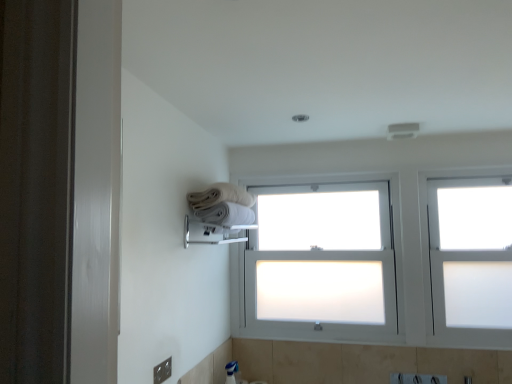
Question: From a real-world perspective, is white soft towel at upper center, which is counted as the 2th towel, starting from the top, positioned under white frosted glass window at upper right based on gravity?

Choices:
 (A) yes
 (B) no

Answer: (B)

Question: Does white soft towel at upper center, positioned as the first towel in bottom-to-top order, have a smaller size compared to white frosted glass window at upper right?

Choices:
 (A) yes
 (B) no

Answer: (A)

Question: From the image's perspective, is white soft towel at upper center, positioned as the first towel in bottom-to-top order, located beneath white frosted glass window at upper right?

Choices:
 (A) yes
 (B) no

Answer: (B)

Question: Is white soft towel at upper center, which is counted as the 2th towel, starting from the top, closer to the viewer compared to white frosted glass window at upper right?

Choices:
 (A) no
 (B) yes

Answer: (B)

Question: Is white soft towel at upper center, which is counted as the 2th towel, starting from the top, further to the viewer compared to white frosted glass window at upper right?

Choices:
 (A) no
 (B) yes

Answer: (A)

Question: Is white soft towel at upper center, which is counted as the 2th towel, starting from the top, positioned beyond the bounds of white frosted glass window at upper right?

Choices:
 (A) yes
 (B) no

Answer: (A)

Question: Considering the relative positions of polished chrome towel bar at upper center and white frosted glass bay window at center in the image provided, is polished chrome towel bar at upper center to the left of white frosted glass bay window at center from the viewer's perspective?

Choices:
 (A) yes
 (B) no

Answer: (A)

Question: Does polished chrome towel bar at upper center appear on the right side of white frosted glass bay window at center?

Choices:
 (A) yes
 (B) no

Answer: (B)

Question: Would you consider polished chrome towel bar at upper center to be distant from white frosted glass bay window at center?

Choices:
 (A) no
 (B) yes

Answer: (A)

Question: Is polished chrome towel bar at upper center further to camera compared to white frosted glass bay window at center?

Choices:
 (A) no
 (B) yes

Answer: (A)

Question: Does polished chrome towel bar at upper center have a greater width compared to white frosted glass bay window at center?

Choices:
 (A) yes
 (B) no

Answer: (A)

Question: From the image's perspective, does polished chrome towel bar at upper center appear lower than white frosted glass bay window at center?

Choices:
 (A) no
 (B) yes

Answer: (A)

Question: Can you confirm if white frosted glass bay window at center is thinner than white soft towel at upper center, which is counted as the 2th towel, starting from the top?

Choices:
 (A) yes
 (B) no

Answer: (A)